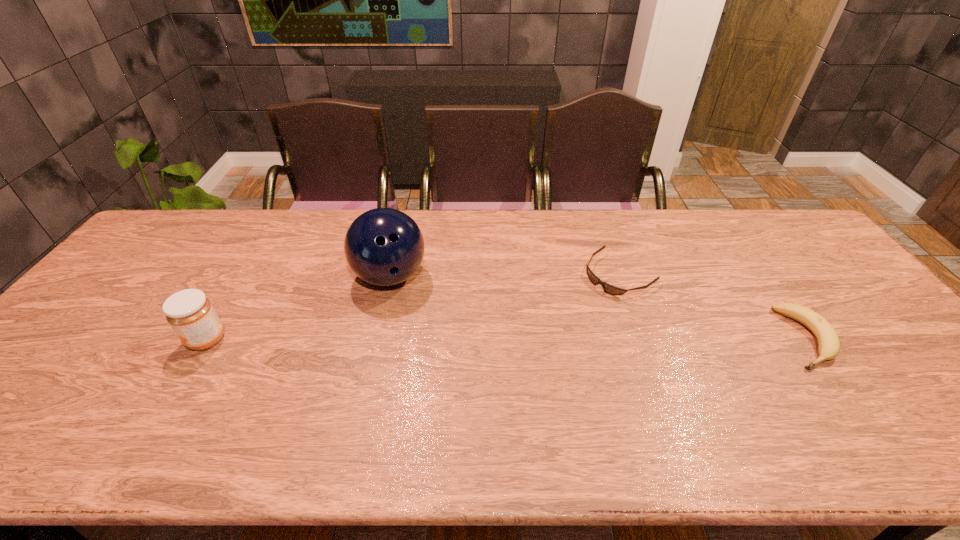
This screenshot has height=540, width=960. I want to click on blank space located on the front label of the leftmost object, so click(x=141, y=340).

In order to click on vacant space situated 0.070m at the stem of the third tallest object in this screenshot , I will do `click(847, 397)`.

Where is `free spot located 0.170m on the front-facing side of the sunglasses`? free spot located 0.170m on the front-facing side of the sunglasses is located at coordinates (558, 319).

You are a GUI agent. You are given a task and a screenshot of the screen. Output one action in this format:
    pyautogui.click(x=<x>, y=<y>)
    Task: Click on the vacant region located 0.340m on the front-facing side of the sunglasses
    
    Given the screenshot: What is the action you would take?
    pyautogui.click(x=512, y=351)

The image size is (960, 540). Find the location of `vacant position located on the front-facing side of the sunglasses`. vacant position located on the front-facing side of the sunglasses is located at coordinates (558, 319).

Image resolution: width=960 pixels, height=540 pixels. What are the coordinates of `free point located on the surface of the bowling ball near the finger holes` in the screenshot? It's located at (461, 345).

Locate an element on the screen. This screenshot has height=540, width=960. vacant space located on the surface of the bowling ball near the finger holes is located at coordinates (487, 370).

Identify the location of vacant space located on the surface of the bowling ball near the finger holes. The image size is (960, 540). (497, 381).

Find the location of a particular element. vacant space at the far edge is located at coordinates (496, 212).

You are a GUI agent. You are given a task and a screenshot of the screen. Output one action in this format:
    pyautogui.click(x=<x>, y=<y>)
    Task: Click on the vacant position at the near edge of the desktop
    The height and width of the screenshot is (540, 960).
    Given the screenshot: What is the action you would take?
    pyautogui.click(x=777, y=390)